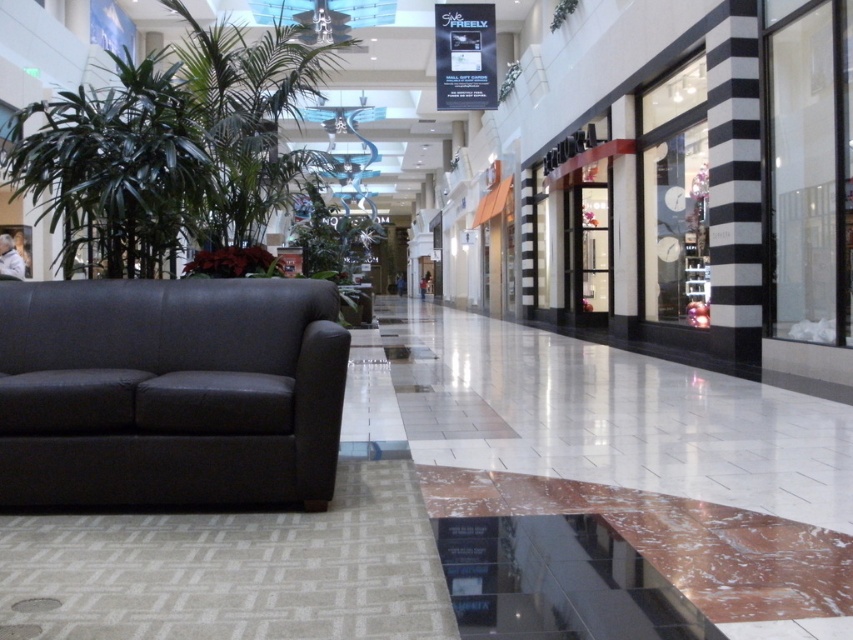
Does matte black couch at left come behind green leafy plant at left?

No, it is not.

Where is `matte black couch at left`? Image resolution: width=853 pixels, height=640 pixels. matte black couch at left is located at coordinates click(x=169, y=392).

At what (x,y) coordinates should I click in order to perform the action: click on matte black couch at left. Please return your answer as a coordinate pair (x, y). The width and height of the screenshot is (853, 640). Looking at the image, I should click on (169, 392).